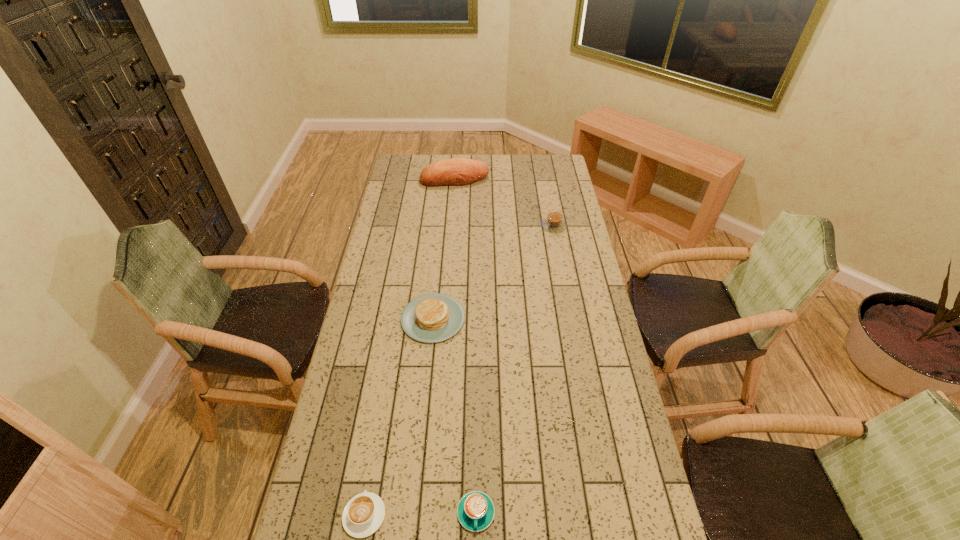
Image resolution: width=960 pixels, height=540 pixels. What are the coordinates of `unoccupied position between the tallest cappuccino and the third nearest object` in the screenshot? It's located at (493, 272).

Identify the location of vacant space that is in between the second cappuccino from right to left and the leftmost cappuccino. (420, 514).

Identify which object is located as the second nearest to the tallest object. Please provide its 2D coordinates. Your answer should be formatted as a tuple, i.e. [(x, y)], where the tuple contains the x and y coordinates of a point satisfying the conditions above.

[(430, 318)]

Locate which object is the closest to the leftmost cappuccino. Please provide its 2D coordinates. Your answer should be formatted as a tuple, i.e. [(x, y)], where the tuple contains the x and y coordinates of a point satisfying the conditions above.

[(475, 511)]

Where is `cappuccino that stands as the third closest to the tallest object`? The height and width of the screenshot is (540, 960). cappuccino that stands as the third closest to the tallest object is located at coordinates (364, 513).

Identify which cappuccino is the nearest to the fourth nearest object. Please provide its 2D coordinates. Your answer should be formatted as a tuple, i.e. [(x, y)], where the tuple contains the x and y coordinates of a point satisfying the conditions above.

[(475, 511)]

Where is `vacant position in the image that satisfies the following two spatial constraints: 1. on the back side of the rightmost object; 2. on the left side of the third nearest object`? vacant position in the image that satisfies the following two spatial constraints: 1. on the back side of the rightmost object; 2. on the left side of the third nearest object is located at coordinates (443, 225).

Find the location of `vacant space that satisfies the following two spatial constraints: 1. on the front side of the farthest cappuccino; 2. on the right side of the farthest object`. vacant space that satisfies the following two spatial constraints: 1. on the front side of the farthest cappuccino; 2. on the right side of the farthest object is located at coordinates (451, 225).

You are a GUI agent. You are given a task and a screenshot of the screen. Output one action in this format:
    pyautogui.click(x=<x>, y=<y>)
    Task: Click on the vacant position in the image that satisfies the following two spatial constraints: 1. on the side of the leftmost cappuccino with the handle; 2. on the right side of the tallest object
    The width and height of the screenshot is (960, 540).
    Given the screenshot: What is the action you would take?
    pyautogui.click(x=421, y=179)

The width and height of the screenshot is (960, 540). I want to click on free region that satisfies the following two spatial constraints: 1. on the side of the leftmost cappuccino with the handle; 2. on the left side of the rightmost object, so click(414, 225).